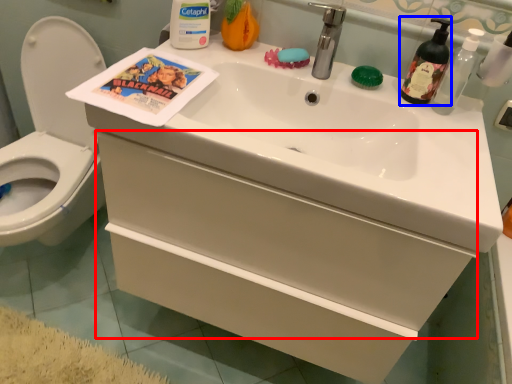
Question: Which object is closer to the camera taking this photo, drawer (highlighted by a red box) or soap dispenser (highlighted by a blue box)?

Choices:
 (A) drawer
 (B) soap dispenser

Answer: (A)